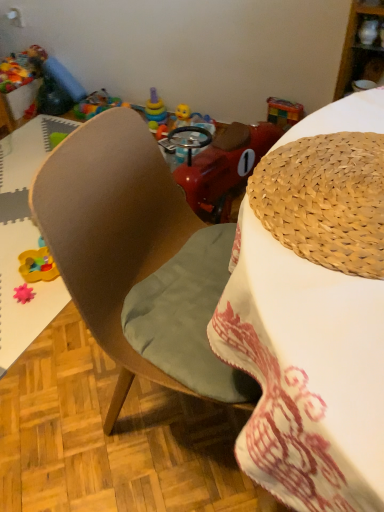
I want to click on free point above rubberized plastic toy at upper left, positioned as the 2th toy in right-to-left order (from a real-world perspective), so pos(100,101).